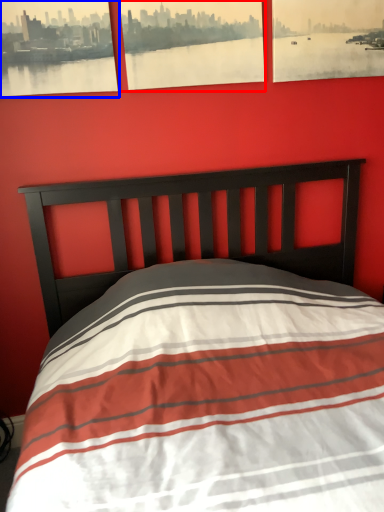
Question: Which object appears farthest to the camera in this image, picture frame (highlighted by a red box) or picture frame (highlighted by a blue box)?

Choices:
 (A) picture frame
 (B) picture frame

Answer: (A)